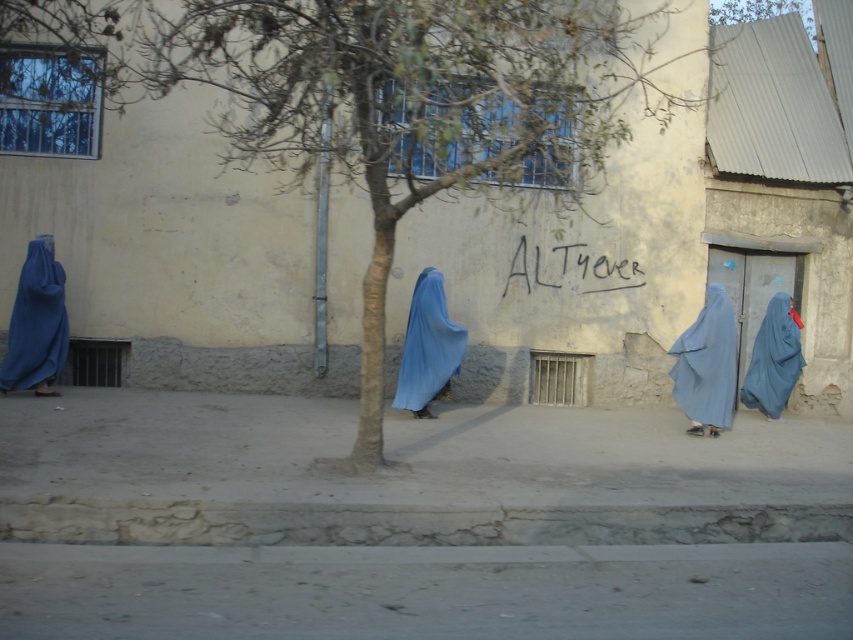
Which is in front, point (55, 321) or point (775, 403)?

Point (55, 321) is in front.

Who is positioned more to the left, blue fabric burqa at left or blue matte burqa at right?

blue fabric burqa at left is more to the left.

Between point (57, 316) and point (770, 326), which one is positioned in front?

Point (57, 316) is in front.

The image size is (853, 640). Identify the location of blue fabric burqa at left. (36, 323).

Who is lower down, green leafy tree at center or blue fabric burqa at left?

Positioned lower is blue fabric burqa at left.

Which is more to the left, green leafy tree at center or blue fabric burqa at left?

blue fabric burqa at left is more to the left.

The height and width of the screenshot is (640, 853). What do you see at coordinates (387, 100) in the screenshot?
I see `green leafy tree at center` at bounding box center [387, 100].

At what (x,y) coordinates should I click in order to perform the action: click on green leafy tree at center. Please return your answer as a coordinate pair (x, y). This screenshot has height=640, width=853. Looking at the image, I should click on (387, 100).

Is point (62, 362) farther from viewer compared to point (442, 324)?

Yes, it is behind point (442, 324).

Can you confirm if blue fabric burqa at left is bigger than blue matte burqa at center?

Actually, blue fabric burqa at left might be smaller than blue matte burqa at center.

Where is `blue fabric burqa at left`? This screenshot has width=853, height=640. blue fabric burqa at left is located at coordinates (36, 323).